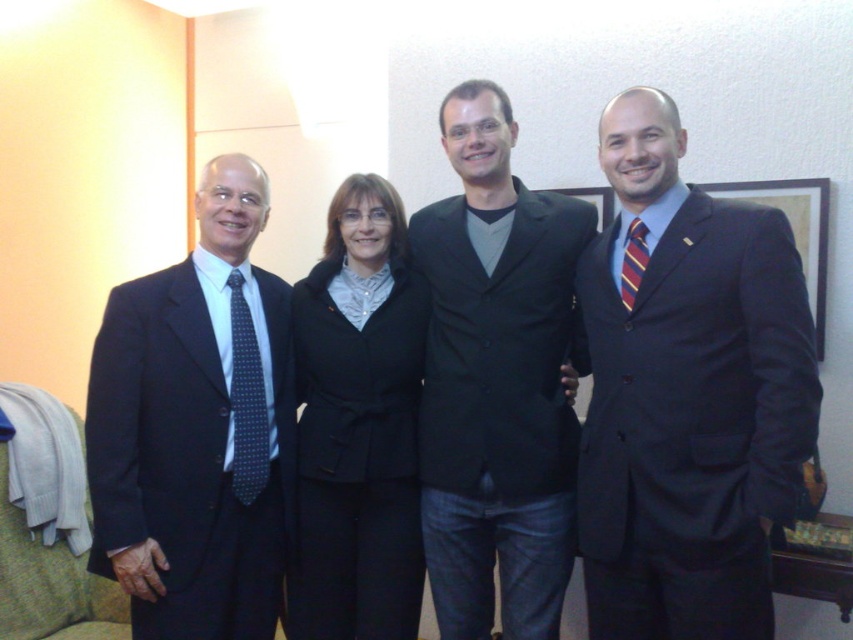
Looking at this image, you are a photographer adjusting your camera settings to capture the group photo. You notice the striped fabric tie at right and the black fabric picture frame at center. Which object is positioned higher in the image?

The striped fabric tie at right is taller than the black fabric picture frame at center, so the striped fabric tie at right is positioned higher in the image.

You are a photographer setting up for a group photo. You need to arrange the matte black suit at left and the black matte blazer at center so that both are visible in the frame. Given their heights, which one should you position closer to the camera to ensure both are fully visible?

Since the matte black suit at left is shorter than the black matte blazer at center, you should position the matte black suit at left closer to the camera to ensure both are fully visible in the frame.

Based on the photo, you are an interior designer arranging a photo wall. You have a striped fabric tie at right and a black fabric picture frame at center. Which object should be placed lower to maintain the visual balance?

The striped fabric tie at right should be placed lower because it is positioned under the black fabric picture frame at center in the original arrangement.